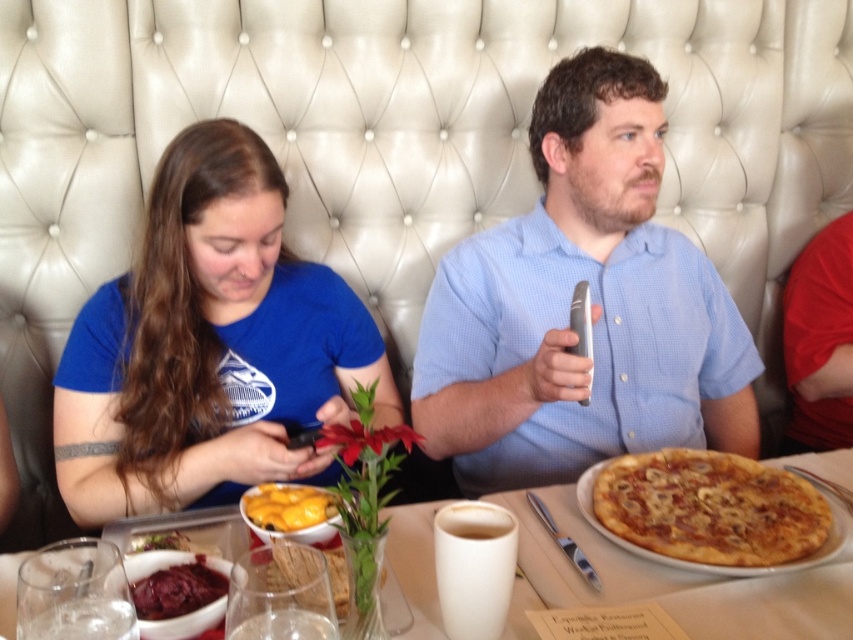
Between blue cotton shirt at upper left and smooth brown bread at lower left, which one appears on the right side from the viewer's perspective?

blue cotton shirt at upper left

What are the coordinates of `blue cotton shirt at upper left` in the screenshot? It's located at pyautogui.click(x=592, y=307).

Who is lower down, white ceramic mug at center or smooth dark red jam at lower left?

smooth dark red jam at lower left is lower down.

Who is more distant from viewer, [575,600] or [189,568]?

The point [575,600] is more distant.

Which is in front, point (524, 547) or point (134, 593)?

Positioned in front is point (134, 593).

The height and width of the screenshot is (640, 853). In order to click on white ceramic mug at center in this screenshot , I will do `click(674, 586)`.

Can you confirm if blue cotton shirt at upper left is shorter than yellow matte cheese at center?

Incorrect, blue cotton shirt at upper left's height does not fall short of yellow matte cheese at center's.

Image resolution: width=853 pixels, height=640 pixels. What do you see at coordinates (592, 307) in the screenshot?
I see `blue cotton shirt at upper left` at bounding box center [592, 307].

Locate an element on the screen. The image size is (853, 640). blue cotton shirt at upper left is located at coordinates (592, 307).